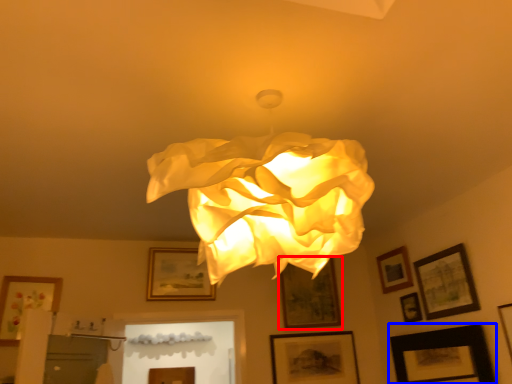
Question: Among these objects, which one is nearest to the camera, picture frame (highlighted by a red box) or picture frame (highlighted by a blue box)?

Choices:
 (A) picture frame
 (B) picture frame

Answer: (B)